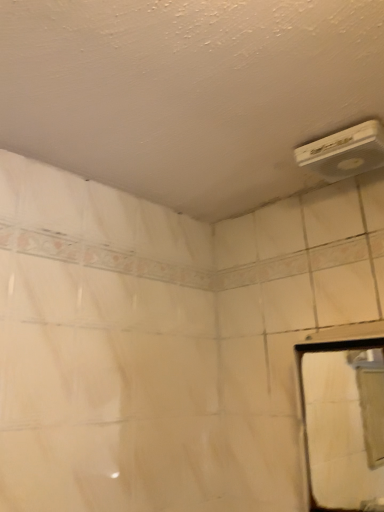
Question: Is white glossy mirror at right turned away from white plastic air conditioning unit at upper right?

Choices:
 (A) no
 (B) yes

Answer: (A)

Question: Is white glossy mirror at right far from white plastic air conditioning unit at upper right?

Choices:
 (A) no
 (B) yes

Answer: (B)

Question: Is white glossy mirror at right in front of white plastic air conditioning unit at upper right?

Choices:
 (A) no
 (B) yes

Answer: (B)

Question: Does white glossy mirror at right appear on the left side of white plastic air conditioning unit at upper right?

Choices:
 (A) yes
 (B) no

Answer: (B)

Question: From a real-world perspective, is white glossy mirror at right physically above white plastic air conditioning unit at upper right?

Choices:
 (A) no
 (B) yes

Answer: (A)

Question: Is white glossy mirror at right outside white plastic air conditioning unit at upper right?

Choices:
 (A) no
 (B) yes

Answer: (B)

Question: From a real-world perspective, is white plastic air conditioning unit at upper right located beneath white glossy mirror at right?

Choices:
 (A) no
 (B) yes

Answer: (A)

Question: Does white plastic air conditioning unit at upper right appear on the left side of white glossy mirror at right?

Choices:
 (A) no
 (B) yes

Answer: (B)

Question: Is the position of white plastic air conditioning unit at upper right more distant than that of white glossy mirror at right?

Choices:
 (A) no
 (B) yes

Answer: (B)

Question: Does white plastic air conditioning unit at upper right have a larger size compared to white glossy mirror at right?

Choices:
 (A) no
 (B) yes

Answer: (A)

Question: From the image's perspective, is white plastic air conditioning unit at upper right located above white glossy mirror at right?

Choices:
 (A) no
 (B) yes

Answer: (B)

Question: Is white glossy mirror at right surrounded by white plastic air conditioning unit at upper right?

Choices:
 (A) no
 (B) yes

Answer: (A)

Question: From their relative heights in the image, would you say white glossy mirror at right is taller or shorter than white plastic air conditioning unit at upper right?

Choices:
 (A) short
 (B) tall

Answer: (B)